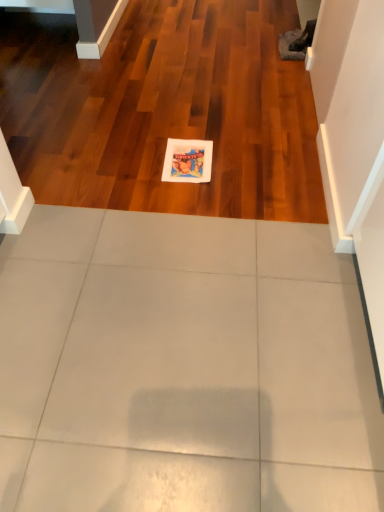
Where is `free spot behind matte paper postcard at center`? This screenshot has width=384, height=512. free spot behind matte paper postcard at center is located at coordinates (188, 129).